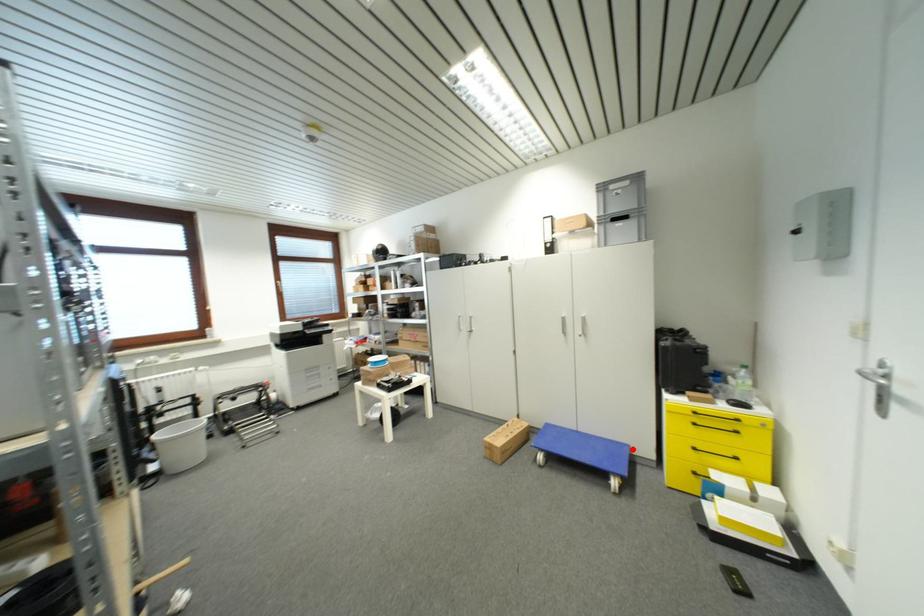
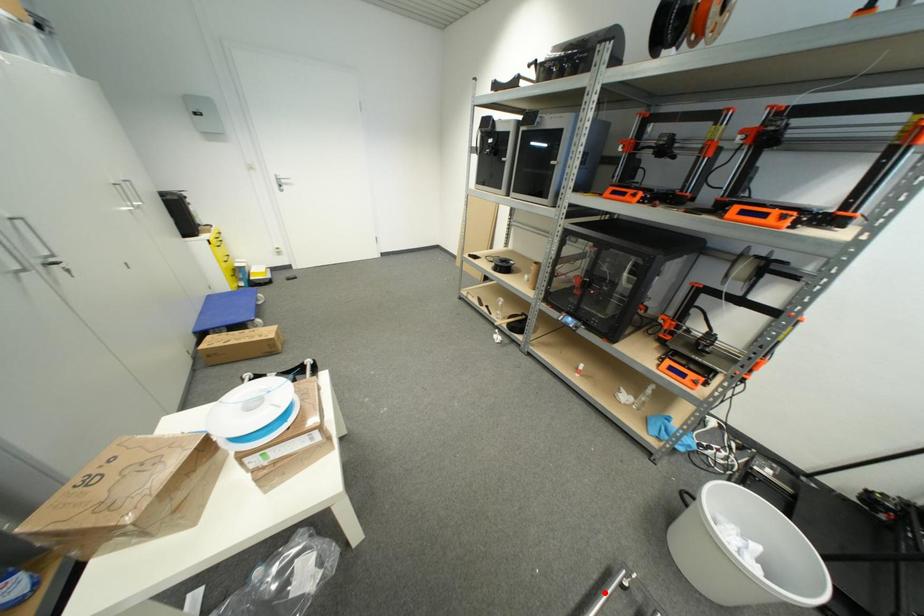
I am providing you with two images of the same scene from different viewpoints. A red point is marked on the first image and another point is marked on the second image. Do the highlighted points in image1 and image2 indicate the same real-world spot?

No